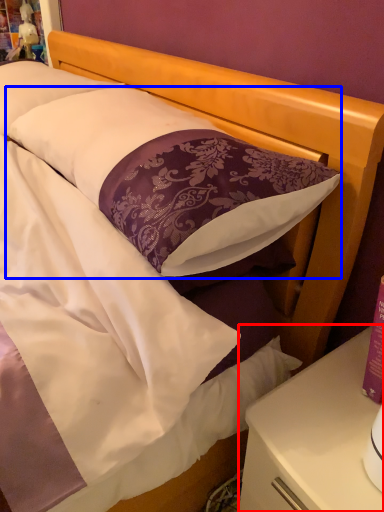
Question: Among these objects, which one is nearest to the camera, nightstand (highlighted by a red box) or pillow (highlighted by a blue box)?

Choices:
 (A) nightstand
 (B) pillow

Answer: (B)